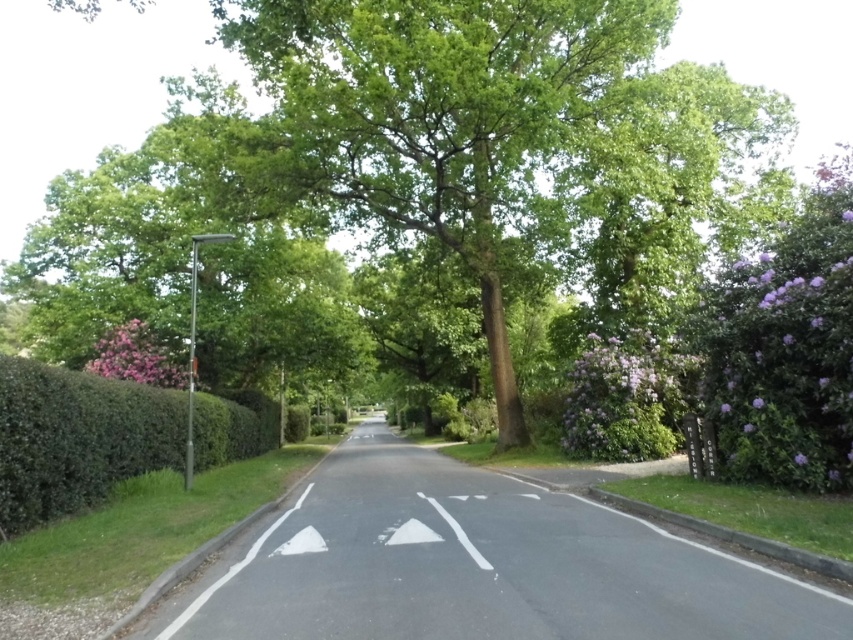
Who is higher up, green leafy tree at center or purple leafy bush at right?

green leafy tree at center is higher up.

Does green leafy tree at center appear under purple leafy bush at right?

No, green leafy tree at center is not below purple leafy bush at right.

At what (x,y) coordinates should I click in order to perform the action: click on green leafy tree at center. Please return your answer as a coordinate pair (x, y). Looking at the image, I should click on (440, 116).

At what (x,y) coordinates should I click in order to perform the action: click on green leafy tree at center. Please return your answer as a coordinate pair (x, y). The width and height of the screenshot is (853, 640). Looking at the image, I should click on (440, 116).

Who is lower down, green leafy hedge at left or purple leafy bush at right?

green leafy hedge at left is lower down.

Does green leafy hedge at left have a greater height compared to purple leafy bush at right?

Indeed, green leafy hedge at left has a greater height compared to purple leafy bush at right.

Is point (228, 412) closer to viewer compared to point (621, 358)?

No, (228, 412) is further to viewer.

Identify the location of green leafy hedge at left. (77, 436).

Can you confirm if green leafy tree at center is shorter than green leafy hedge at left?

Incorrect, green leafy tree at center's height does not fall short of green leafy hedge at left's.

Is green leafy tree at center positioned in front of green leafy hedge at left?

No, it is not.

Find the location of `green leafy tree at center`. green leafy tree at center is located at coordinates (440, 116).

Identify the location of green leafy tree at center. (440, 116).